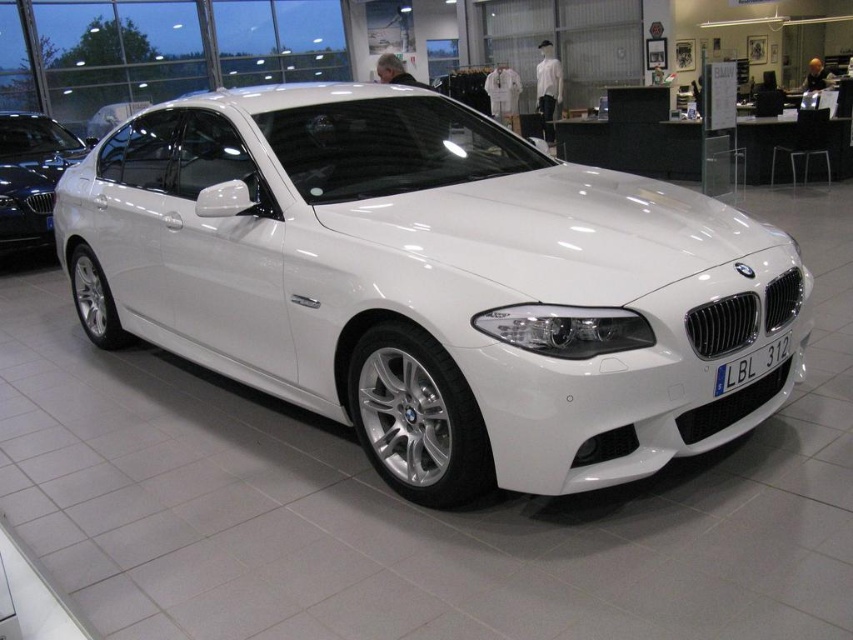
You are a photographer trying to capture the white glossy car at center without the black plastic license plate at front appearing in the shot. How can you adjust your camera angle to achieve this?

Since the white glossy car at center is in front of the black plastic license plate at front, you can position your camera to focus on the side or rear of the white glossy car at center where the license plate is not visible.

You are a delivery person who needs to load a package onto a shelf that is 1.8 meters tall. You have to walk past the white glossy sedan at center and the black plastic license plate at front. Which object will you have to look up more to see the top of?

The white glossy sedan at center has a greater height compared to the black plastic license plate at front, so you will have to look up more to see the top of the white glossy sedan at center.